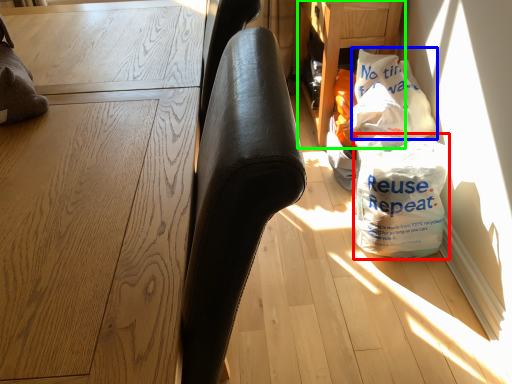
Question: Based on their relative distances, which object is nearer to grocery bag (highlighted by a red box)? Choose from grocery bag (highlighted by a blue box) and table (highlighted by a green box).

Choices:
 (A) grocery bag
 (B) table

Answer: (A)